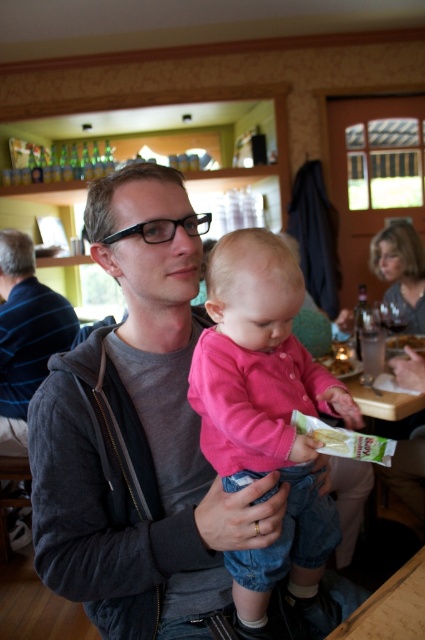
Question: Which point is closer to the camera?

Choices:
 (A) (28, 280)
 (B) (387, 339)
 (C) (342, 372)

Answer: (C)

Question: Among these objects, which one is farthest from the camera?

Choices:
 (A) pink matte sweater at center
 (B) white paper bag at right
 (C) gray matte jacket at center
 (D) green plastic bag at center

Answer: (C)

Question: Can you confirm if green matte snack packet at center is positioned above white paper bag at right?

Choices:
 (A) yes
 (B) no

Answer: (B)

Question: Which of the following is the closest to the observer?

Choices:
 (A) gray matte jacket at center
 (B) green plastic bag at center
 (C) white paper bag at right

Answer: (B)

Question: In this image, where is pink matte sweater at center located relative to green matte snack packet at center?

Choices:
 (A) above
 (B) below

Answer: (B)

Question: Can you confirm if gray matte jacket at center is positioned to the left of white paper bag at right?

Choices:
 (A) no
 (B) yes

Answer: (B)